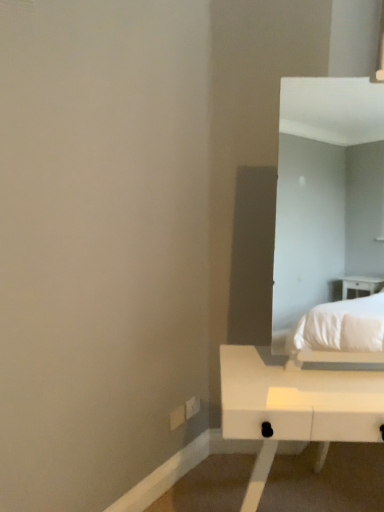
Question: Can you confirm if white plastic electric outlet at lower center, the 1th electric outlet from the left, is shorter than white matte table at lower right?

Choices:
 (A) no
 (B) yes

Answer: (B)

Question: Would you say white plastic electric outlet at lower center, positioned as the 2th electric outlet in right-to-left order, is outside white matte table at lower right?

Choices:
 (A) yes
 (B) no

Answer: (A)

Question: Are white plastic electric outlet at lower center, positioned as the 2th electric outlet in right-to-left order, and white matte table at lower right far apart?

Choices:
 (A) yes
 (B) no

Answer: (B)

Question: Is white plastic electric outlet at lower center, the 1th electric outlet from the left, positioned in front of white matte table at lower right?

Choices:
 (A) no
 (B) yes

Answer: (A)

Question: Is the position of white plastic electric outlet at lower center, positioned as the 2th electric outlet in right-to-left order, more distant than that of white matte table at lower right?

Choices:
 (A) yes
 (B) no

Answer: (A)

Question: Considering their positions, is white matte table at lower right located in front of or behind white plastic electric outlet at lower center, the 1th electric outlet from the left?

Choices:
 (A) behind
 (B) front

Answer: (B)

Question: Considering the positions of white matte table at lower right and white plastic electric outlet at lower center, positioned as the 2th electric outlet in right-to-left order, in the image, is white matte table at lower right taller or shorter than white plastic electric outlet at lower center, positioned as the 2th electric outlet in right-to-left order,?

Choices:
 (A) short
 (B) tall

Answer: (B)

Question: Considering the positions of point (266, 409) and point (178, 413), is point (266, 409) closer or farther from the camera than point (178, 413)?

Choices:
 (A) farther
 (B) closer

Answer: (B)

Question: From a real-world perspective, is white matte table at lower right physically located above or below white plastic electric outlet at lower center, positioned as the 2th electric outlet in right-to-left order?

Choices:
 (A) below
 (B) above

Answer: (B)

Question: From the image's perspective, is white plastic electric outlet at lower center, positioned as the 2th electric outlet in right-to-left order, above or below white plastic electric outlet at lower center, marked as the 2th electric outlet in a left-to-right arrangement?

Choices:
 (A) below
 (B) above

Answer: (A)

Question: Relative to white plastic electric outlet at lower center, which is the 1th electric outlet from right to left, is white plastic electric outlet at lower center, positioned as the 2th electric outlet in right-to-left order, in front or behind?

Choices:
 (A) front
 (B) behind

Answer: (A)

Question: Based on their sizes in the image, would you say white plastic electric outlet at lower center, the 1th electric outlet from the left, is bigger or smaller than white plastic electric outlet at lower center, which is the 1th electric outlet from right to left?

Choices:
 (A) small
 (B) big

Answer: (A)

Question: Visually, is white plastic electric outlet at lower center, the 1th electric outlet from the left, positioned to the left or to the right of white plastic electric outlet at lower center, which is the 1th electric outlet from right to left?

Choices:
 (A) right
 (B) left

Answer: (B)

Question: From the image's perspective, is white plastic electric outlet at lower center, positioned as the 2th electric outlet in right-to-left order, positioned above or below white matte table at lower right?

Choices:
 (A) below
 (B) above

Answer: (B)

Question: Is white plastic electric outlet at lower center, the 1th electric outlet from the left, to the left or to the right of white matte table at lower right in the image?

Choices:
 (A) right
 (B) left

Answer: (B)